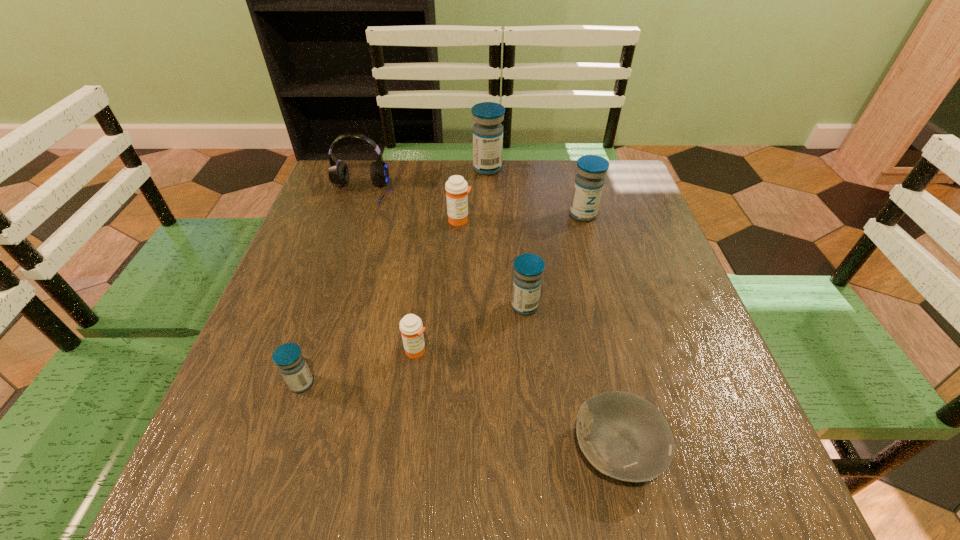
The image size is (960, 540). Find the location of `free space that is in between the leftmost blue medicine and the sixth object from right to left`. free space that is in between the leftmost blue medicine and the sixth object from right to left is located at coordinates (359, 367).

This screenshot has height=540, width=960. Find the location of `free space between the third nearest medicine and the headset`. free space between the third nearest medicine and the headset is located at coordinates (443, 250).

Identify the location of free space between the bigger orange medicine and the biggest blue medicine. (473, 194).

Where is `free space between the headset and the second nearest blue medicine`? This screenshot has width=960, height=540. free space between the headset and the second nearest blue medicine is located at coordinates (443, 250).

You are a GUI agent. You are given a task and a screenshot of the screen. Output one action in this format:
    pyautogui.click(x=<x>, y=<y>)
    Task: Click on the vacant region between the third nearest blue medicine and the headset
    This screenshot has height=540, width=960.
    Given the screenshot: What is the action you would take?
    pyautogui.click(x=471, y=204)

Find the location of a particular element. This screenshot has height=540, width=960. vacant space that is in between the farthest blue medicine and the sixth object from right to left is located at coordinates (452, 260).

You are a GUI agent. You are given a task and a screenshot of the screen. Output one action in this format:
    pyautogui.click(x=<x>, y=<y>)
    Task: Click on the unoccupied position between the headset and the shortest object
    The image size is (960, 540).
    Given the screenshot: What is the action you would take?
    pyautogui.click(x=489, y=321)

Image resolution: width=960 pixels, height=540 pixels. In order to click on object that stands as the fourth closest to the farther orange medicine in this screenshot , I will do `click(589, 182)`.

At what (x,y) coordinates should I click in order to perform the action: click on the fifth closest object relative to the gray bowl. Please return your answer as a coordinate pair (x, y). The image size is (960, 540). Looking at the image, I should click on (457, 189).

The height and width of the screenshot is (540, 960). In order to click on medicine that is the third closest to the farthest blue medicine in this screenshot , I will do `click(528, 268)`.